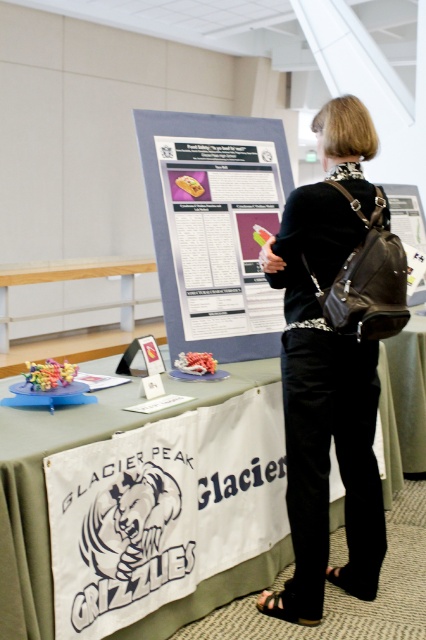
You are attending a presentation and need to locate the white fabric banner at lower center. Based on the scene, where would you find it relative to the matte gray poster at center?

The white fabric banner at lower center is positioned below the matte gray poster at center.

Based on the scene description, can you determine which object is positioned to the right when comparing the matte gray poster at center and the white fabric banner at lower center?

The matte gray poster at center is positioned to the right of the white fabric banner at lower center according to the description.